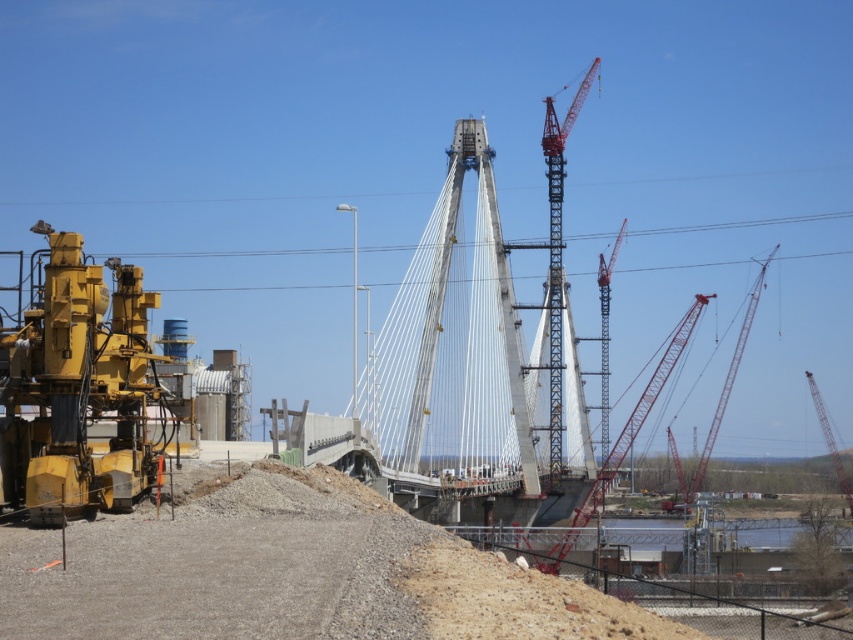
You are an engineer inspecting the construction site. You need to move the red metallic crane at right to the left side of the red metal crane at center. Is this possible given their current positions?

The red metallic crane at right is positioned on the right side of the red metal crane at center. Moving it to the left side would require space, but based on the description, there is no information about available space or obstructions, so it is uncertain if this is possible.